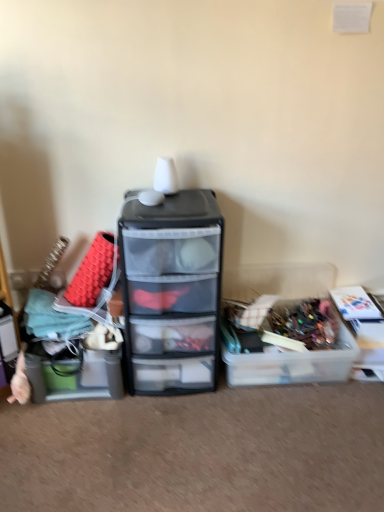
Where is `free space on the front side of translucent plastic container at center-right, acting as the second storage box starting from the left`? This screenshot has width=384, height=512. free space on the front side of translucent plastic container at center-right, acting as the second storage box starting from the left is located at coordinates (286, 435).